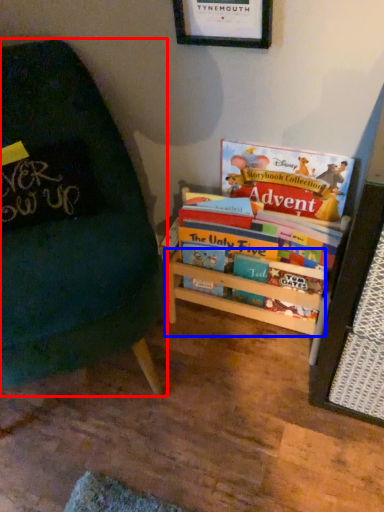
Question: Which object appears farthest to the camera in this image, chair (highlighted by a red box) or shelf (highlighted by a blue box)?

Choices:
 (A) chair
 (B) shelf

Answer: (B)